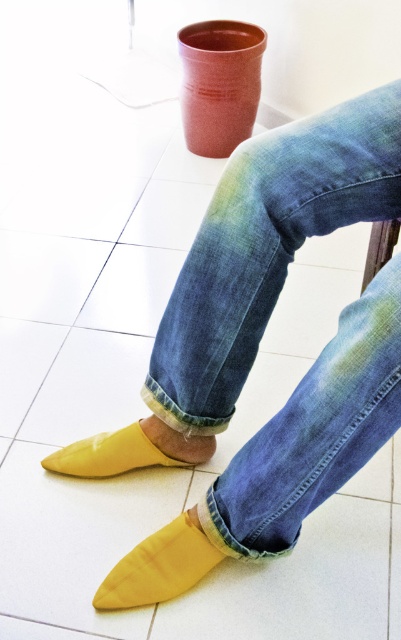
Question: Does denim at center have a greater width compared to matte yellow slipper at lower left?

Choices:
 (A) yes
 (B) no

Answer: (A)

Question: Which point is farther from the camera taking this photo?

Choices:
 (A) (271, 234)
 (B) (74, 464)
 (C) (251, 205)
 (D) (194, 516)

Answer: (B)

Question: Which object appears farthest from the camera in this image?

Choices:
 (A) washed denim jeans at center
 (B) matte yellow slipper at lower left
 (C) yellow fabric socks at lower left

Answer: (B)

Question: Does denim at center appear over washed denim jeans at center?

Choices:
 (A) yes
 (B) no

Answer: (A)

Question: Which point appears farthest from the camera in this image?

Choices:
 (A) (332, 216)
 (B) (123, 577)
 (C) (277, 529)

Answer: (B)

Question: Is washed denim jeans at center closer to camera compared to yellow rubber slipper at lower left?

Choices:
 (A) no
 (B) yes

Answer: (B)